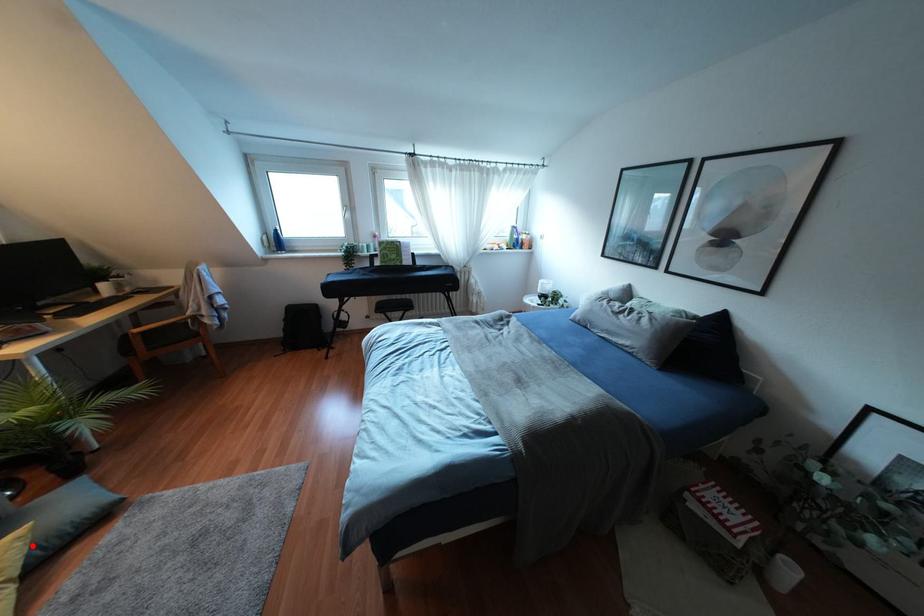
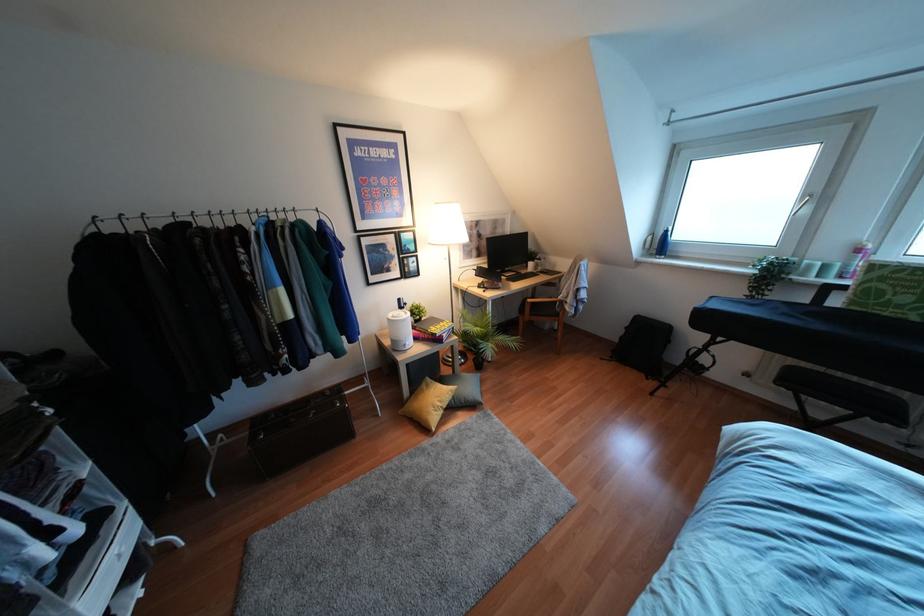
Find the pixel in the second image that matches the highlighted location in the first image.

(453, 397)